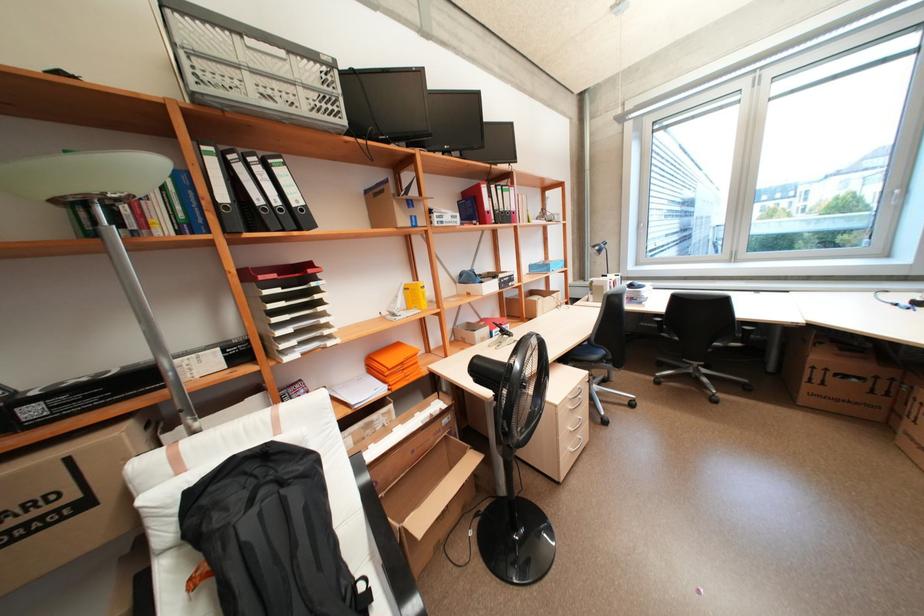
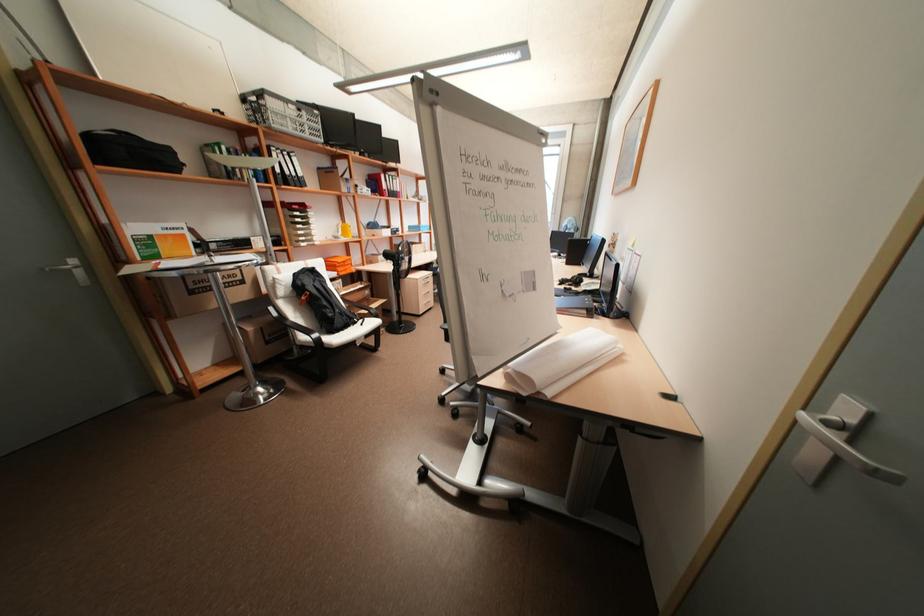
The point at (264,169) is marked in the first image. Where is the corresponding point in the second image?

(293, 158)